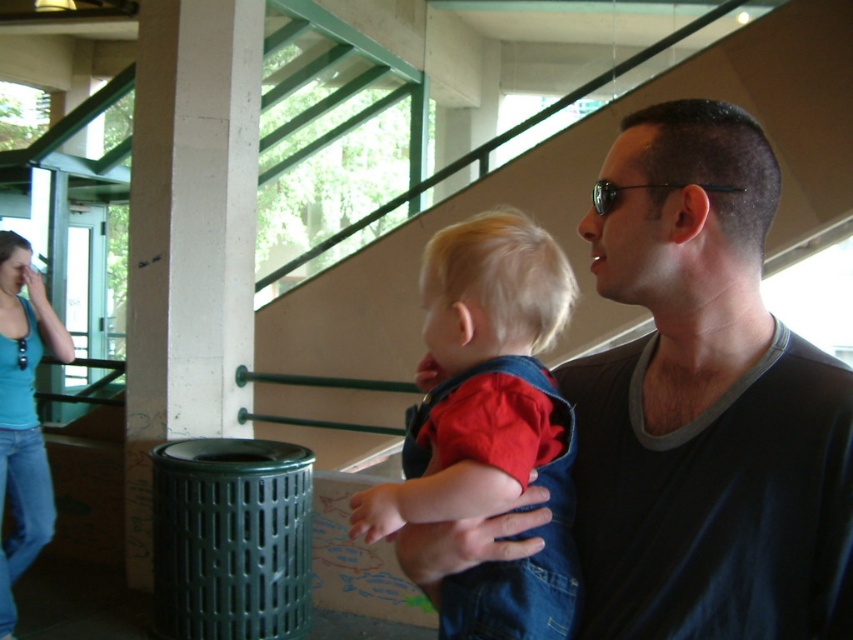
Is denim overalls at center to the right of blue denim jeans at left from the viewer's perspective?

Indeed, denim overalls at center is positioned on the right side of blue denim jeans at left.

Between denim overalls at center and blue denim jeans at left, which one appears on the right side from the viewer's perspective?

denim overalls at center is more to the right.

What do you see at coordinates (489, 422) in the screenshot?
I see `denim overalls at center` at bounding box center [489, 422].

In order to click on denim overalls at center in this screenshot , I will do `click(489, 422)`.

Does point (787, 355) come farther from viewer compared to point (480, 333)?

No, it is in front of (480, 333).

Can you confirm if dark gray shirt at center is smaller than denim overalls at center?

Incorrect, dark gray shirt at center is not smaller in size than denim overalls at center.

Which is behind, point (817, 364) or point (445, 637)?

The point (445, 637) is behind.

This screenshot has width=853, height=640. What are the coordinates of `dark gray shirt at center` in the screenshot? It's located at (704, 404).

Which of these two, dark gray shirt at center or blue denim jeans at left, stands shorter?

dark gray shirt at center is shorter.

The image size is (853, 640). Describe the element at coordinates (704, 404) in the screenshot. I see `dark gray shirt at center` at that location.

Describe the element at coordinates (704, 404) in the screenshot. The width and height of the screenshot is (853, 640). I see `dark gray shirt at center` at that location.

You are a GUI agent. You are given a task and a screenshot of the screen. Output one action in this format:
    pyautogui.click(x=<x>, y=<y>)
    Task: Click on the dark gray shirt at center
    
    Given the screenshot: What is the action you would take?
    pyautogui.click(x=704, y=404)